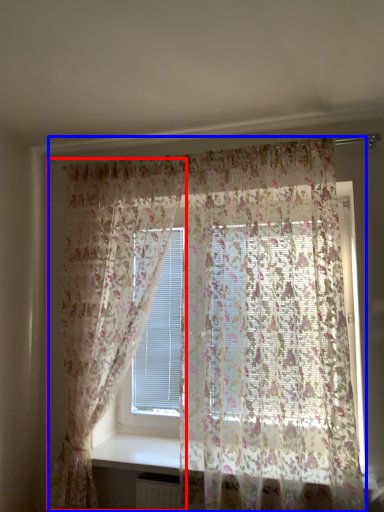
Question: Which of the following is the farthest to the observer, curtain (highlighted by a red box) or curtain (highlighted by a blue box)?

Choices:
 (A) curtain
 (B) curtain

Answer: (A)